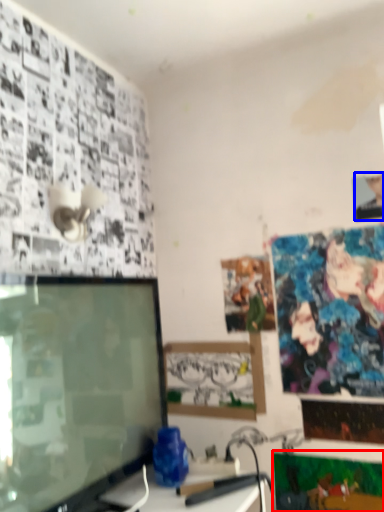
Question: Which point is further to the camera, poster page (highlighted by a red box) or person (highlighted by a blue box)?

Choices:
 (A) poster page
 (B) person

Answer: (B)